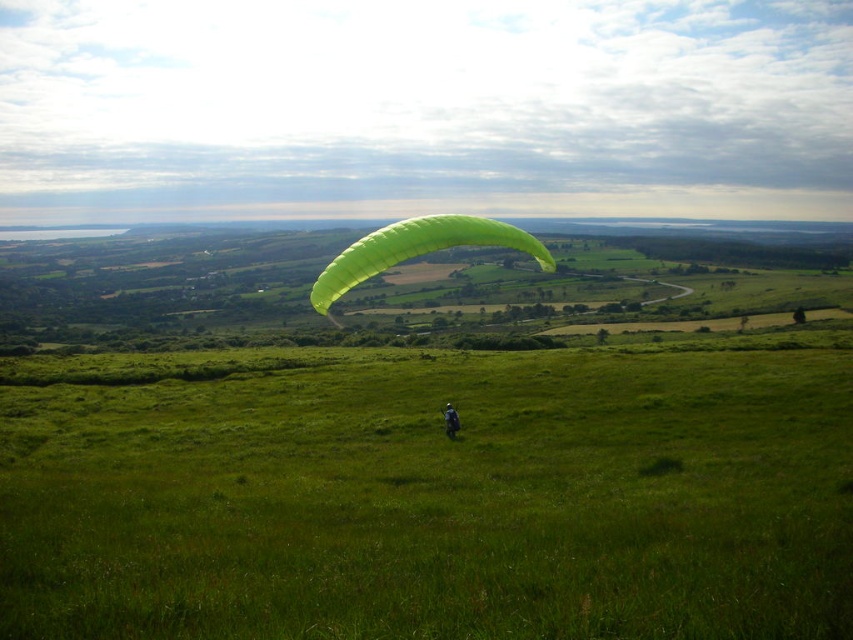
You are a photographer trying to capture the green matte parachute at center and the green fabric paraglider at center in the same frame. Which object should you focus on first to ensure both are in focus?

The green matte parachute at center is in front of the green fabric paraglider at center, so you should focus on the green matte parachute at center first to ensure both are in focus.

You are standing on the grassy field in the scene and want to approach both the green matte parachute at center and the green fabric paraglider at center. Which one should you head towards first if you want to reach the one closer to your right side?

You should head towards the green fabric paraglider at center first because the green matte parachute at center is to the left of it, meaning the green fabric paraglider at center is closer to your right side.